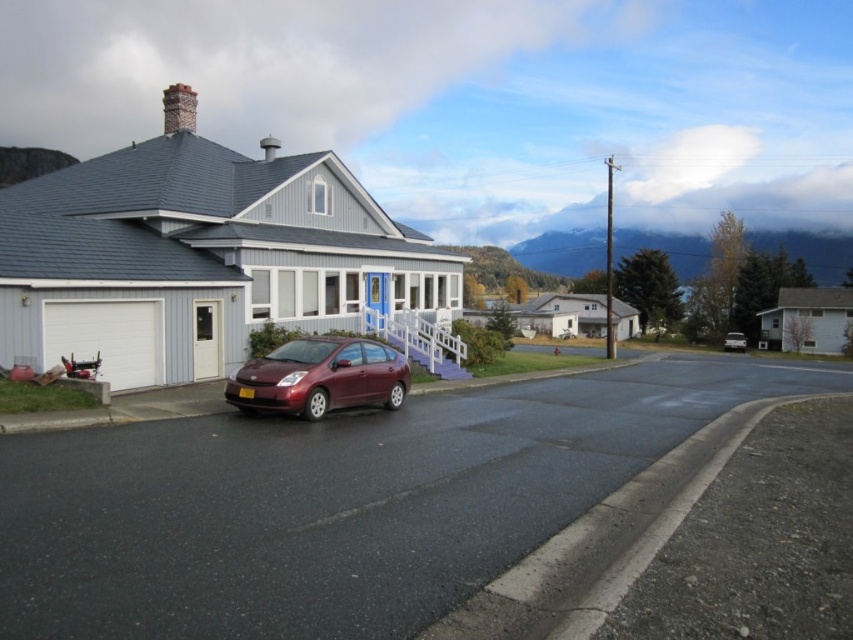
Question: Among these points, which one is farthest from the camera?

Choices:
 (A) (758, 340)
 (B) (746, 339)

Answer: (A)

Question: Which of the following is the farthest from the observer?

Choices:
 (A) satin burgundy car at lower center
 (B) white matte garage at left
 (C) metallic silver sedan at center
 (D) white matte garage at right

Answer: (C)

Question: Among these objects, which one is farthest from the camera?

Choices:
 (A) satin burgundy car at lower center
 (B) white matte garage at right

Answer: (B)

Question: Does white matte garage at left have a greater width compared to metallic silver sedan at center?

Choices:
 (A) no
 (B) yes

Answer: (B)

Question: Can you confirm if white matte garage at left is positioned to the left of white matte garage at right?

Choices:
 (A) yes
 (B) no

Answer: (A)

Question: Does white matte garage at left have a lesser width compared to satin burgundy car at lower center?

Choices:
 (A) yes
 (B) no

Answer: (B)